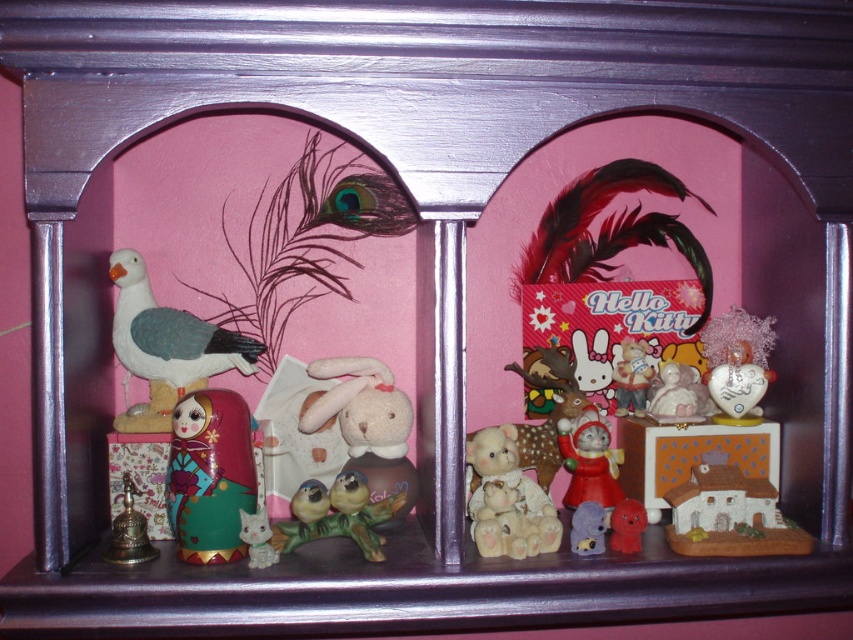
You are organizing a display on the shelf and need to ensure that the tallest item is placed at the back for visibility. Which item should be positioned at the back between the fluffy white plush rabbit at center and the porcelain birds at center?

The fluffy white plush rabbit at center should be placed at the back because it has a greater height compared to the porcelain birds at center.

You are a collector who wants to place a new small sculpture between the fluffy white plush rabbit at center and the porcelain birds at center on the shelf. The sculpture is 2.5 inches wide. Will there be enough space between them to fit the sculpture without moving any existing items?

The fluffy white plush rabbit at center and the porcelain birds at center are 2.68 inches apart. Since the sculpture is 2.5 inches wide, there is enough space to place it between them without moving existing items.

You are standing 40 inches away from the decorative shelf and want to reach the matte plastic cat at center. Can you grab it without moving closer?

The matte plastic cat at center is 37.66 inches away from the camera, so you are currently 40 inches away from the shelf. Since the distance is slightly further than the required reach, you might need to move a little closer to comfortably grab it.